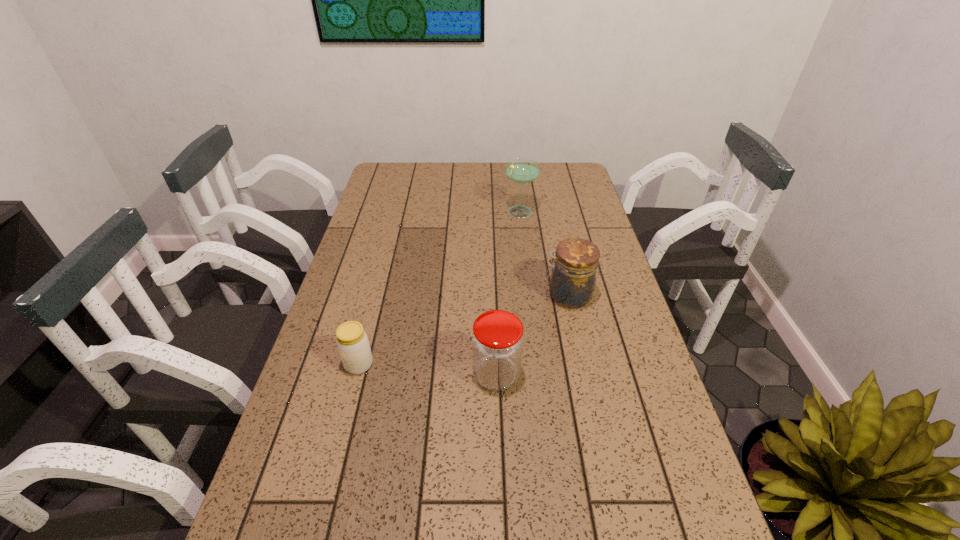
This screenshot has height=540, width=960. Identify the location of the farthest object. (521, 170).

Identify the location of the third nearest object. This screenshot has width=960, height=540. (573, 278).

Identify the location of the farthest jar. (573, 278).

You are a GUI agent. You are given a task and a screenshot of the screen. Output one action in this format:
    pyautogui.click(x=<x>, y=<y>)
    Task: Click on the second jar from right to left
    
    Given the screenshot: What is the action you would take?
    pyautogui.click(x=497, y=342)

Find the location of `the leftmost jar`. the leftmost jar is located at coordinates (352, 341).

You are a GUI agent. You are given a task and a screenshot of the screen. Output one action in this format:
    pyautogui.click(x=<x>, y=<y>)
    Task: Click on the leftmost object
    
    Given the screenshot: What is the action you would take?
    pyautogui.click(x=352, y=341)

At what (x,y) coordinates should I click in order to perform the action: click on vacant space located 0.180m on the front of the farthest object. Please return your answer as a coordinate pair (x, y). Looking at the image, I should click on (525, 253).

The width and height of the screenshot is (960, 540). Find the location of `vacant space located on the lid of the farthest jar`. vacant space located on the lid of the farthest jar is located at coordinates (444, 296).

What are the coordinates of `free space located 0.070m on the lid of the farthest jar` in the screenshot? It's located at (518, 296).

At what (x,y) coordinates should I click in order to perform the action: click on vacant space located on the lid of the farthest jar. Please return your answer as a coordinate pair (x, y). Looking at the image, I should click on (423, 296).